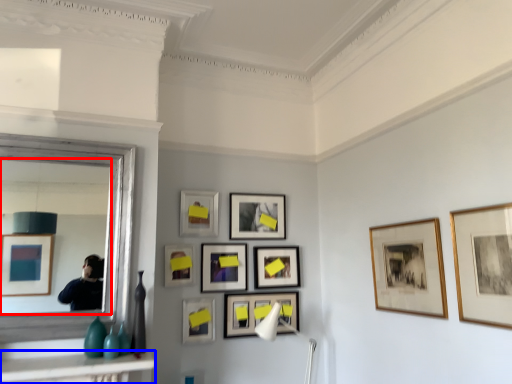
Question: Which point is closer to the camera, mirror (highlighted by a red box) or table (highlighted by a blue box)?

Choices:
 (A) mirror
 (B) table

Answer: (B)